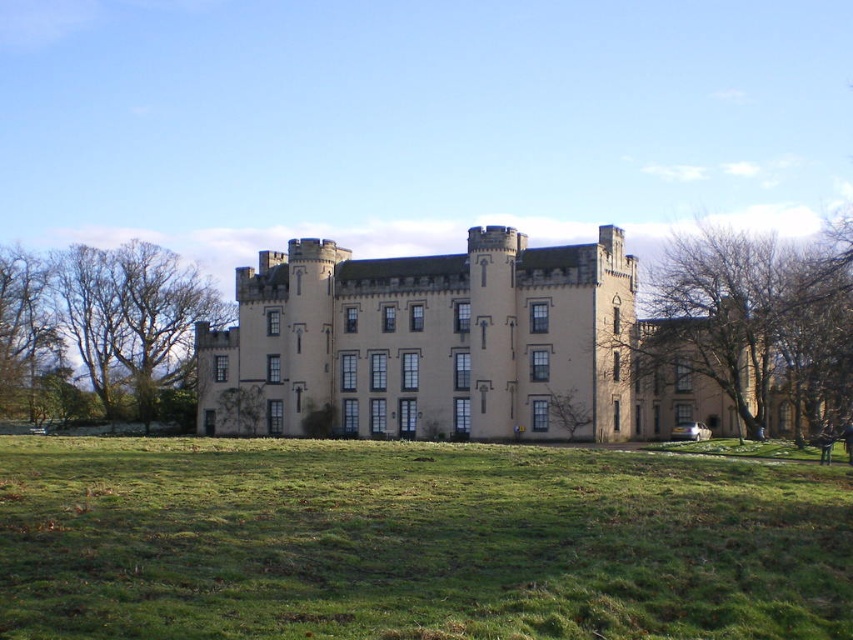
Question: Can you confirm if bare branches at right is smaller than bare branches at left?

Choices:
 (A) no
 (B) yes

Answer: (A)

Question: Is green grass at center above bare branches at right?

Choices:
 (A) no
 (B) yes

Answer: (A)

Question: Considering the relative positions of green grass at center and bare branches at right in the image provided, where is green grass at center located with respect to bare branches at right?

Choices:
 (A) left
 (B) right

Answer: (A)

Question: Which point appears closest to the camera in this image?

Choices:
 (A) (433, 458)
 (B) (445, 419)
 (C) (1, 282)
 (D) (671, 275)

Answer: (A)

Question: Considering the real-world distances, which object is closest to the bare branches at left?

Choices:
 (A) bare branches at right
 (B) green grass at center

Answer: (A)

Question: Which of the following is the closest to the observer?

Choices:
 (A) green grass at center
 (B) bare branches at left
 (C) beige stone castle at center
 (D) bare branches at right

Answer: (A)